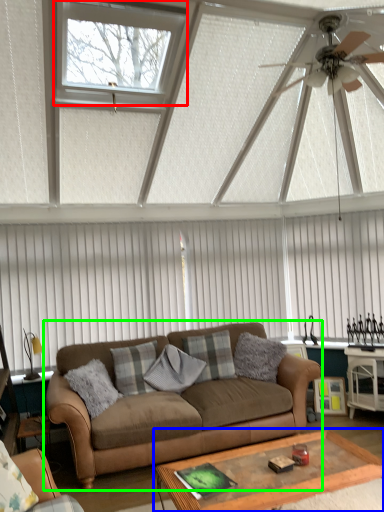
Question: Which object is positioned farthest from window (highlighted by a red box)? Select from coffee table (highlighted by a blue box) and studio couch (highlighted by a green box).

Choices:
 (A) coffee table
 (B) studio couch

Answer: (A)